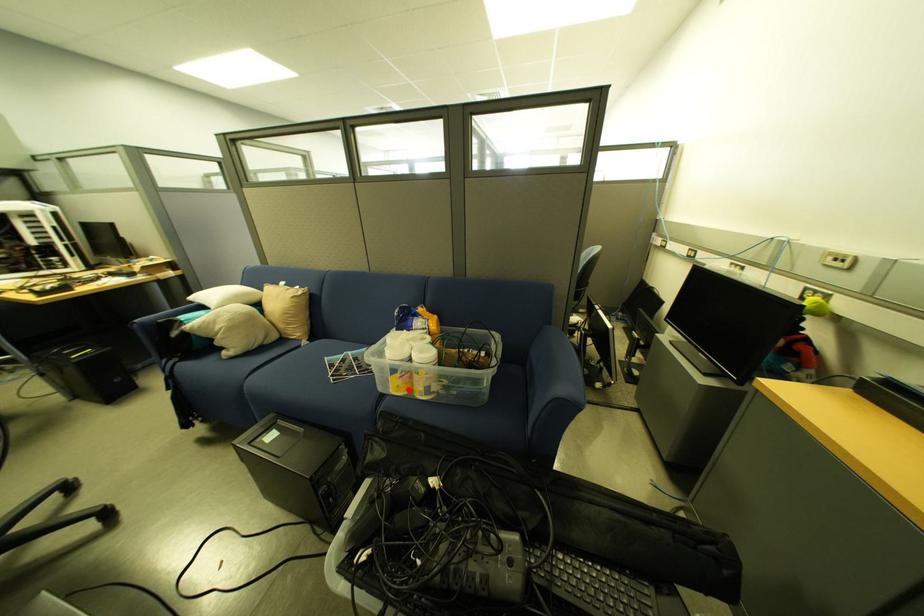
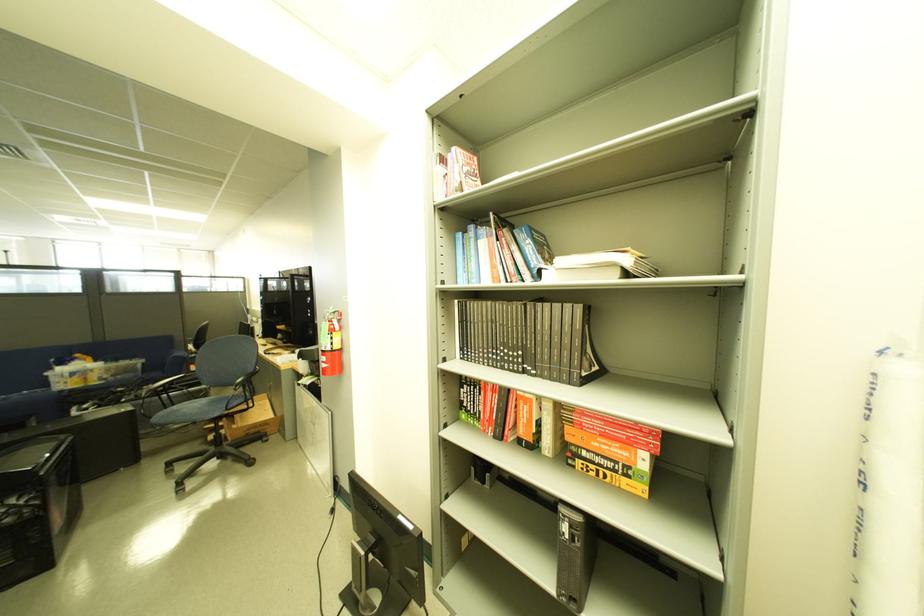
Question: I am providing you with two images of the same scene from different viewpoints. In image1, a red point is highlighted. Considering the same 3D point in image2, which of the following is correct?

Choices:
 (A) It is closer
 (B) It is farther

Answer: (A)